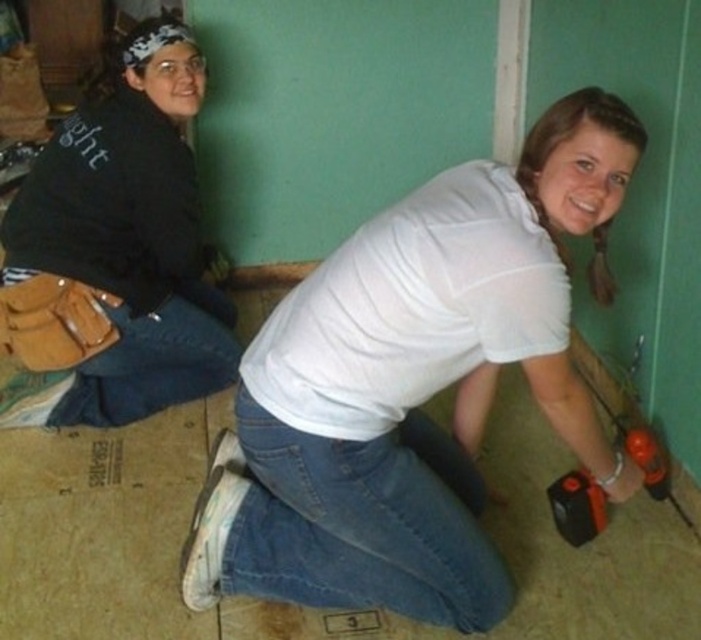
Which is behind, point (390, 292) or point (172, 35)?

The point (172, 35) is behind.

Is point (266, 506) closer to viewer compared to point (76, 294)?

Yes, it is in front of point (76, 294).

The height and width of the screenshot is (640, 701). I want to click on white matte shirt at center, so click(x=415, y=385).